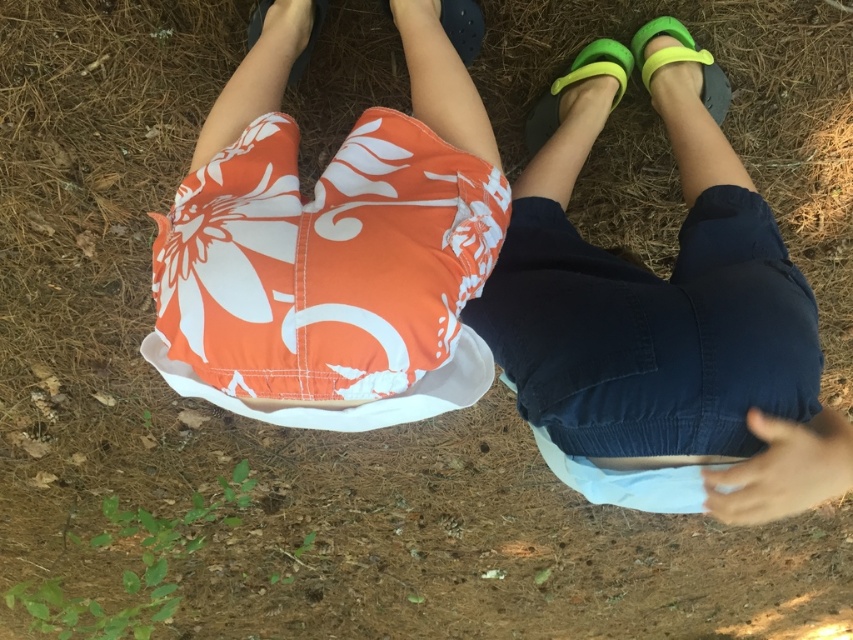
Question: Among these objects, which one is nearest to the camera?

Choices:
 (A) neon green rubber sandal at lower right
 (B) rubber textured sandal at upper center

Answer: (B)

Question: Estimate the real-world distances between objects in this image. Which object is closer to the rubber textured sandal at upper center?

Choices:
 (A) dark blue denim shorts at center
 (B) neon green rubber sandal at upper right

Answer: (B)

Question: Considering the real-world distances, which object is farthest from the rubber textured sandal at upper center?

Choices:
 (A) neon green rubber sandal at lower right
 (B) orange floral shorts at center
 (C) dark blue denim shorts at center

Answer: (C)

Question: Can you confirm if neon green rubber sandal at upper right is positioned to the right of matte black sandal at upper center?

Choices:
 (A) no
 (B) yes

Answer: (B)

Question: Is orange floral shorts at center closer to the viewer compared to neon green rubber sandal at upper right?

Choices:
 (A) yes
 (B) no

Answer: (A)

Question: Is dark blue denim shorts at center to the right of neon green rubber sandal at upper right from the viewer's perspective?

Choices:
 (A) no
 (B) yes

Answer: (B)